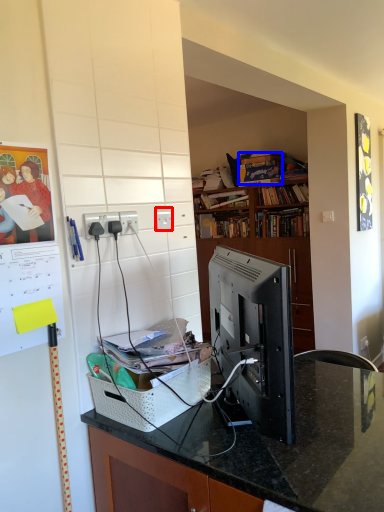
Question: Among these objects, which one is farthest to the camera, electric outlet (highlighted by a red box) or book (highlighted by a blue box)?

Choices:
 (A) electric outlet
 (B) book

Answer: (B)